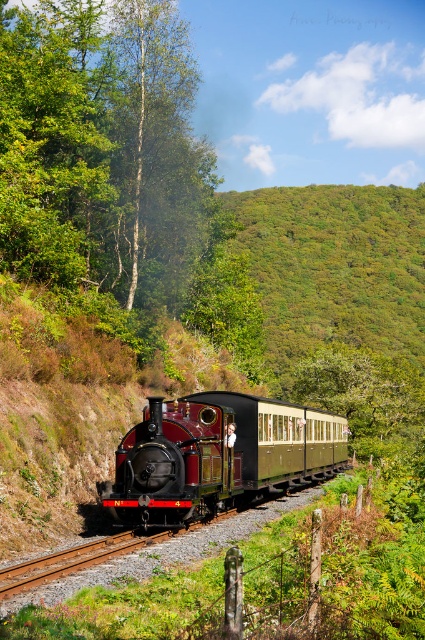
Question: Is green leafy tree at left closer to camera compared to polished brass train at center?

Choices:
 (A) no
 (B) yes

Answer: (A)

Question: Does green leafy tree at left have a lesser width compared to polished brass train at center?

Choices:
 (A) yes
 (B) no

Answer: (A)

Question: Which of the following is the farthest from the observer?

Choices:
 (A) (167, 244)
 (B) (59, 115)

Answer: (A)

Question: Considering the relative positions of green leafy tree at left and polished brass train at center in the image provided, where is green leafy tree at left located with respect to polished brass train at center?

Choices:
 (A) below
 (B) above

Answer: (B)

Question: Which of the following is the closest to the observer?

Choices:
 (A) (19, 124)
 (B) (155, 516)
 (C) (42, 140)

Answer: (B)

Question: Which point is farther from the camera taking this photo?

Choices:
 (A) (107, 196)
 (B) (172, 118)

Answer: (B)